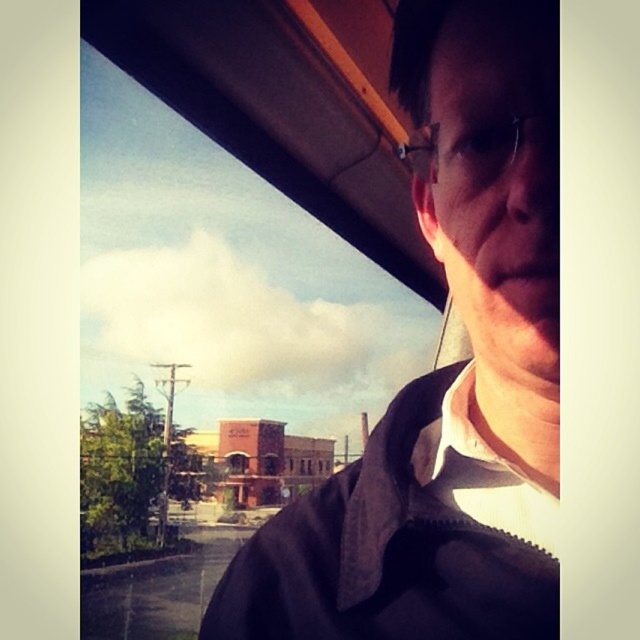
Which is above, brown fabric jacket at upper right or clear plastic glasses at upper center?

Positioned higher is clear plastic glasses at upper center.

Can you confirm if brown fabric jacket at upper right is positioned to the left of clear plastic glasses at upper center?

Indeed, brown fabric jacket at upper right is positioned on the left side of clear plastic glasses at upper center.

This screenshot has height=640, width=640. Find the location of `brown fabric jacket at upper right`. brown fabric jacket at upper right is located at coordinates (444, 369).